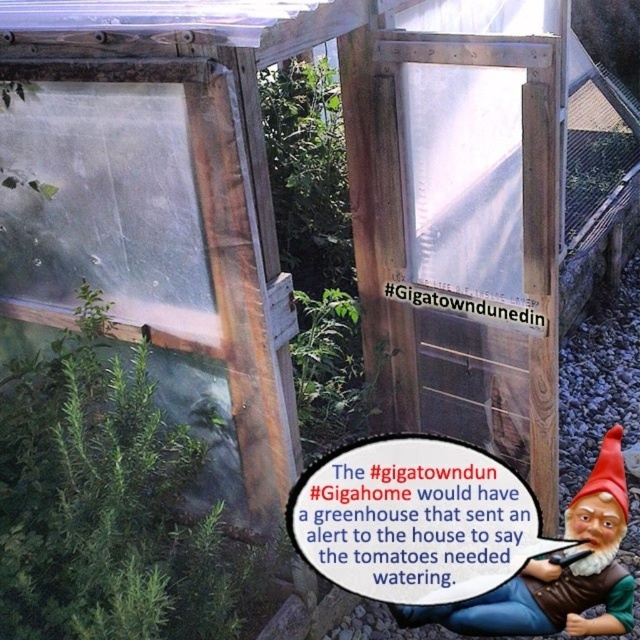
Does green leafy plant at center have a greater height compared to brown wooden gnome at lower right?

Yes, green leafy plant at center is taller than brown wooden gnome at lower right.

Does green leafy plant at center have a lesser width compared to brown wooden gnome at lower right?

No.

Does point (40, 570) come farther from viewer compared to point (596, 499)?

No, (40, 570) is in front of (596, 499).

Locate an element on the screen. Image resolution: width=640 pixels, height=640 pixels. green leafy plant at center is located at coordinates (108, 504).

This screenshot has width=640, height=640. What do you see at coordinates (108, 504) in the screenshot?
I see `green leafy plant at center` at bounding box center [108, 504].

Where is `green leafy plant at center`? green leafy plant at center is located at coordinates (108, 504).

The height and width of the screenshot is (640, 640). Find the location of `green leafy plant at center`. green leafy plant at center is located at coordinates (108, 504).

Is brown wooden gnome at lower right thinner than red felt gnome hat at lower right?

No.

Is point (593, 596) more distant than point (625, 496)?

That is False.

Between point (570, 634) and point (620, 426), which one is positioned in front?

Point (570, 634)

Find the location of a particular element. The height and width of the screenshot is (640, 640). brown wooden gnome at lower right is located at coordinates (557, 572).